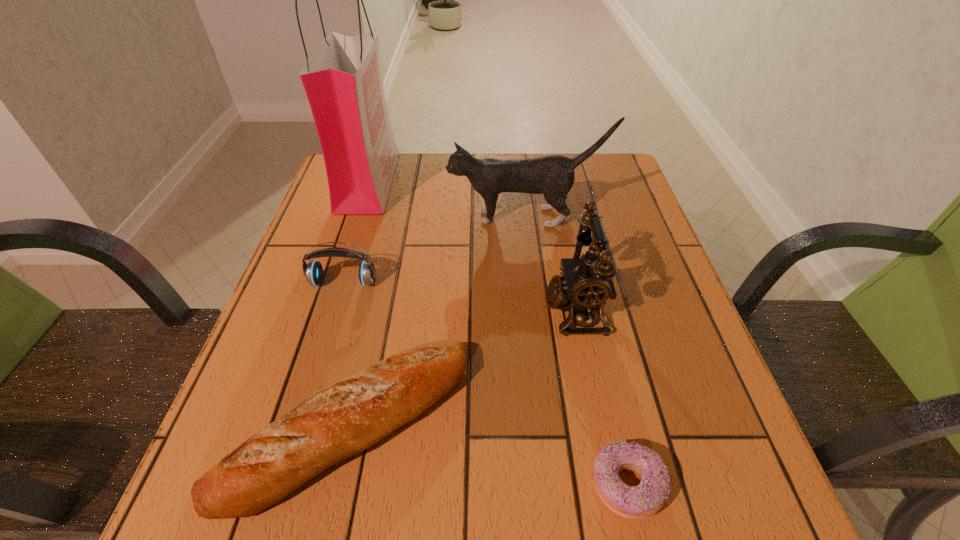
You are a GUI agent. You are given a task and a screenshot of the screen. Output one action in this format:
    pyautogui.click(x=<x>, y=<y>)
    Task: Click on the headset that is positioned at the left edge
    The width and height of the screenshot is (960, 540).
    Given the screenshot: What is the action you would take?
    pyautogui.click(x=313, y=271)

Identify the location of baguet at the left edge. The image size is (960, 540). (341, 420).

This screenshot has height=540, width=960. Find the location of `cat at the right edge`. cat at the right edge is located at coordinates (553, 176).

Where is `telephone located in the right edge section of the desktop`? This screenshot has height=540, width=960. telephone located in the right edge section of the desktop is located at coordinates (587, 283).

Find the location of `doughnut that is at the right edge`. doughnut that is at the right edge is located at coordinates (638, 502).

Locate an element on the screen. The width and height of the screenshot is (960, 540). object situated at the far left corner is located at coordinates (343, 82).

The width and height of the screenshot is (960, 540). In order to click on object present at the near left corner in this screenshot , I will do `click(341, 420)`.

Identify the location of object located at the near right corner. (638, 502).

Image resolution: width=960 pixels, height=540 pixels. Identify the location of blank space at the far edge. (503, 156).

Identify the location of free space at the left edge of the desktop. (357, 292).